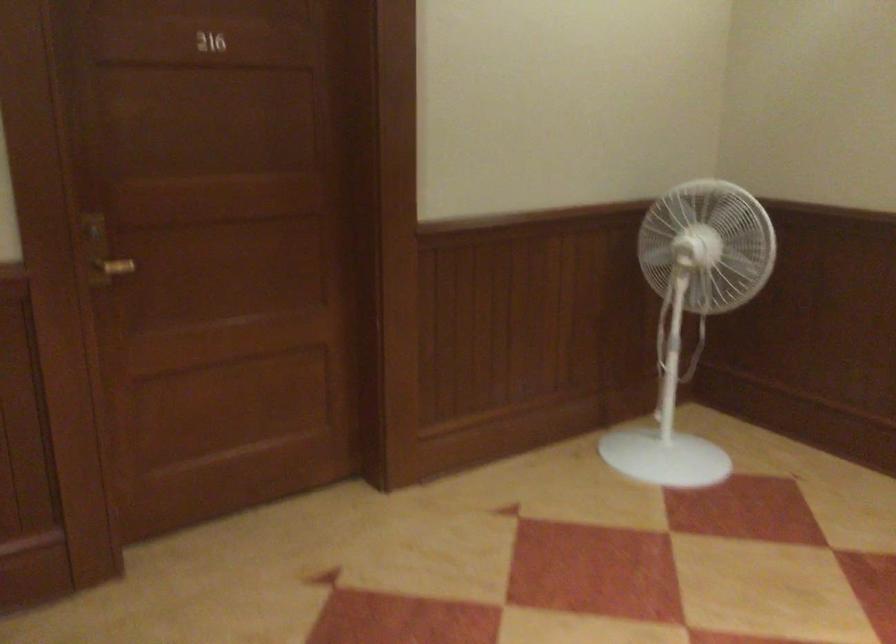
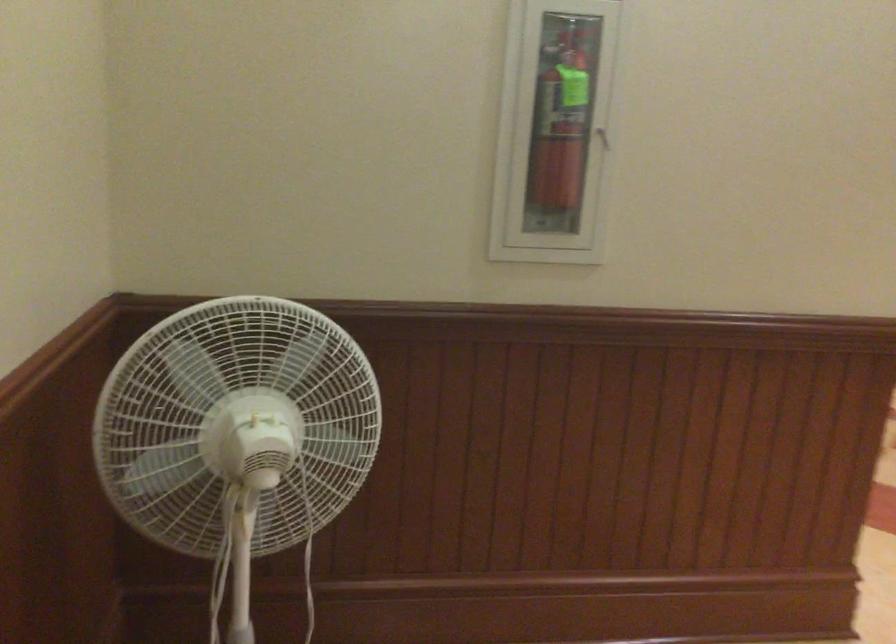
Question: I am providing you with two images of the same scene from different viewpoints. Please identify which objects are invisible in image2.

Choices:
 (A) cardboard tube
 (B) extinguisher case handle
 (C) white standing fan
 (D) red fire extinguisher

Answer: (C)